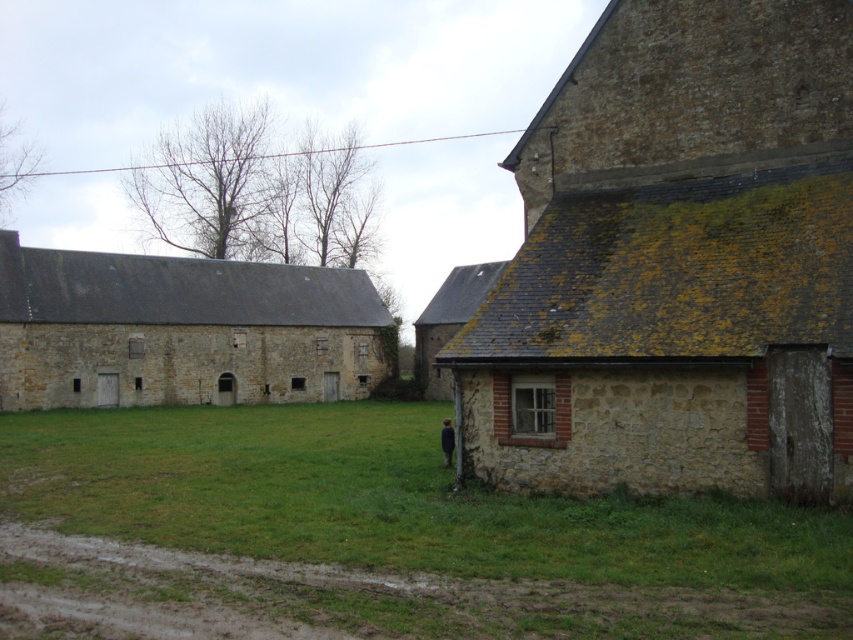
Question: Which is nearer to the green grass at center?

Choices:
 (A) stone barn at left
 (B) stone textured barn at right

Answer: (B)

Question: Which point appears closest to the camera in this image?

Choices:
 (A) (724, 154)
 (B) (39, 356)

Answer: (A)

Question: Can you confirm if stone textured barn at right is smaller than green grass at center?

Choices:
 (A) no
 (B) yes

Answer: (A)

Question: Among these points, which one is farthest from the camera?

Choices:
 (A) (572, 392)
 (B) (405, 440)

Answer: (B)

Question: Is green grass at center smaller than stone barn at left?

Choices:
 (A) no
 (B) yes

Answer: (B)

Question: Is stone textured barn at right above green grass at center?

Choices:
 (A) yes
 (B) no

Answer: (A)